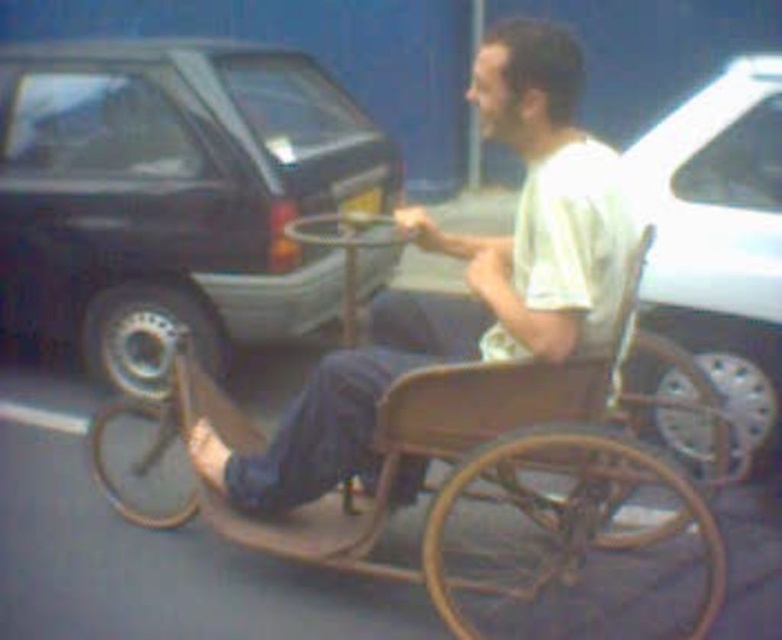
Question: Which point is closer to the camera taking this photo?

Choices:
 (A) (574, 416)
 (B) (752, 280)
 (C) (311, 380)
 (D) (84, 67)

Answer: (A)

Question: Does rusty wood wagon at center have a lesser width compared to white glossy car at right?

Choices:
 (A) yes
 (B) no

Answer: (B)

Question: Does shiny black car at left have a greater width compared to wooden wheelchair at center?

Choices:
 (A) no
 (B) yes

Answer: (B)

Question: Which object is positioned farthest from the shiny black car at left?

Choices:
 (A) rusty wood wagon at center
 (B) white glossy car at right
 (C) wooden wheelchair at center

Answer: (B)

Question: Is shiny black car at left thinner than rusty wood wagon at center?

Choices:
 (A) no
 (B) yes

Answer: (B)

Question: Estimate the real-world distances between objects in this image. Which object is closer to the shiny black car at left?

Choices:
 (A) wooden wheelchair at center
 (B) white glossy car at right
 (C) rusty wood wagon at center

Answer: (C)